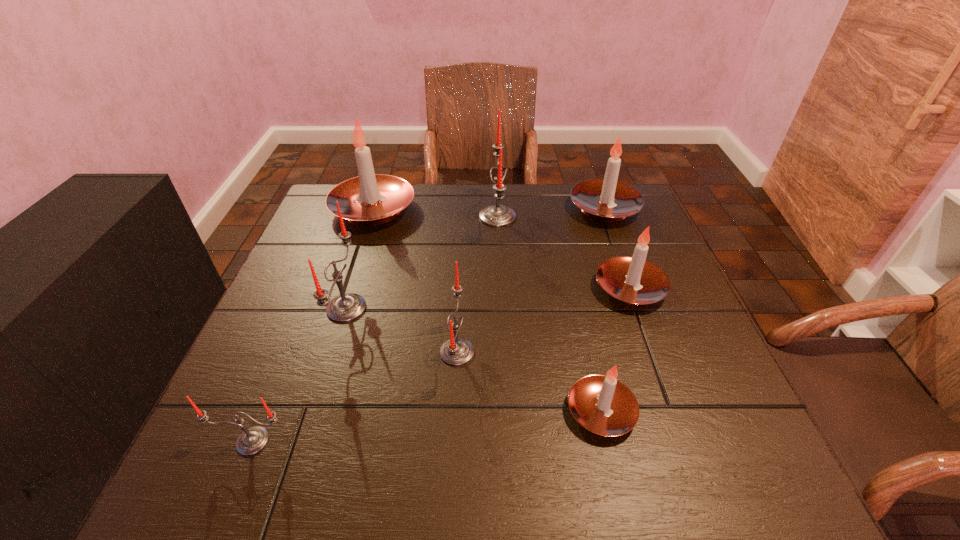
At what (x,y) coordinates should I click in order to perform the action: click on unoccupied area between the fifth object from right to left and the smallest red candle. Please return your answer as a coordinate pair (x, y). The width and height of the screenshot is (960, 540). Looking at the image, I should click on (355, 396).

Where is `free space between the nearest red candle and the biggest white candle`? The image size is (960, 540). free space between the nearest red candle and the biggest white candle is located at coordinates click(313, 325).

This screenshot has height=540, width=960. I want to click on free space between the nearest red candle and the fourth object from left to right, so click(x=355, y=396).

Find the location of `empty space between the nearest white candle and the fifth object from left to right`. empty space between the nearest white candle and the fifth object from left to right is located at coordinates (549, 314).

Choose which object is the fifth nearest neighbor to the third smallest white candle. Please provide its 2D coordinates. Your answer should be formatted as a tuple, i.e. [(x, y)], where the tuple contains the x and y coordinates of a point satisfying the conditions above.

[(603, 405)]

Select which object appears as the seventh closest to the biggest red candle. Please provide its 2D coordinates. Your answer should be formatted as a tuple, i.e. [(x, y)], where the tuple contains the x and y coordinates of a point satisfying the conditions above.

[(252, 440)]

This screenshot has width=960, height=540. Find the location of `the closest candle to the third smallest white candle`. the closest candle to the third smallest white candle is located at coordinates (633, 280).

Where is `candle that is the second closest to the third smallest red candle`? The image size is (960, 540). candle that is the second closest to the third smallest red candle is located at coordinates (456, 351).

Point out which white candle is positioned as the nearest to the third farthest white candle. Please provide its 2D coordinates. Your answer should be formatted as a tuple, i.e. [(x, y)], where the tuple contains the x and y coordinates of a point satisfying the conditions above.

[(608, 200)]

Identify which white candle is the third closest to the smallest red candle. Please provide its 2D coordinates. Your answer should be formatted as a tuple, i.e. [(x, y)], where the tuple contains the x and y coordinates of a point satisfying the conditions above.

[(633, 280)]